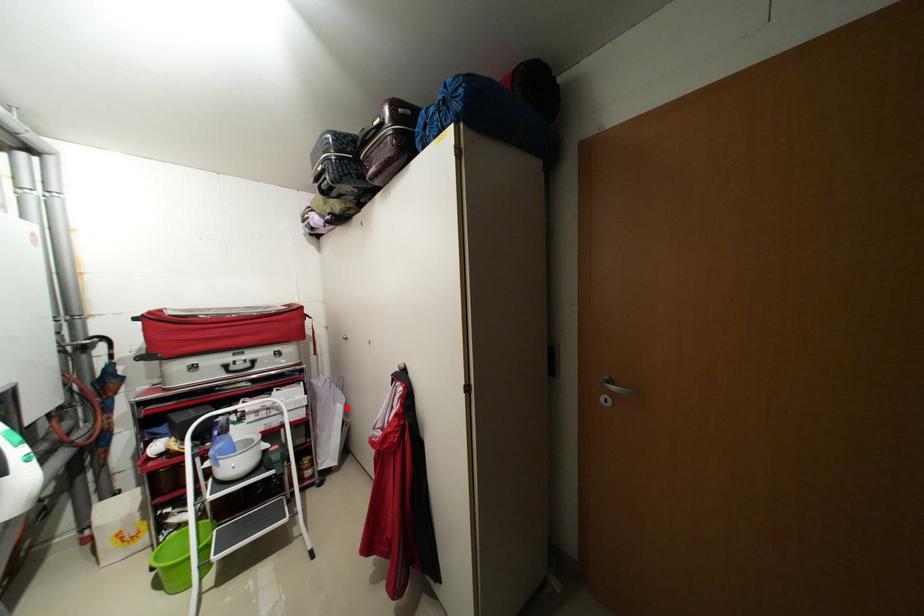
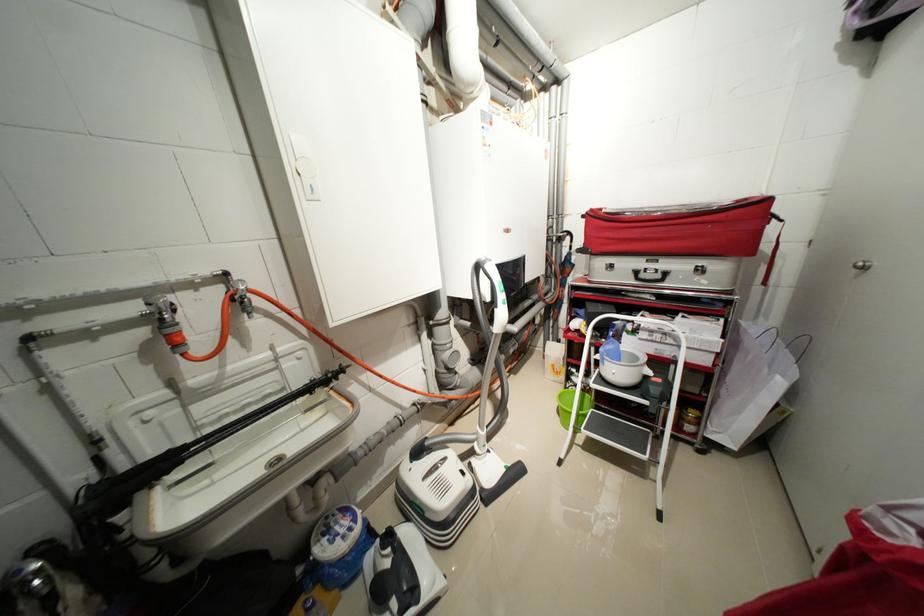
The point at the highlighted location is marked in the first image. Where is the corresponding point in the second image?

(787, 384)